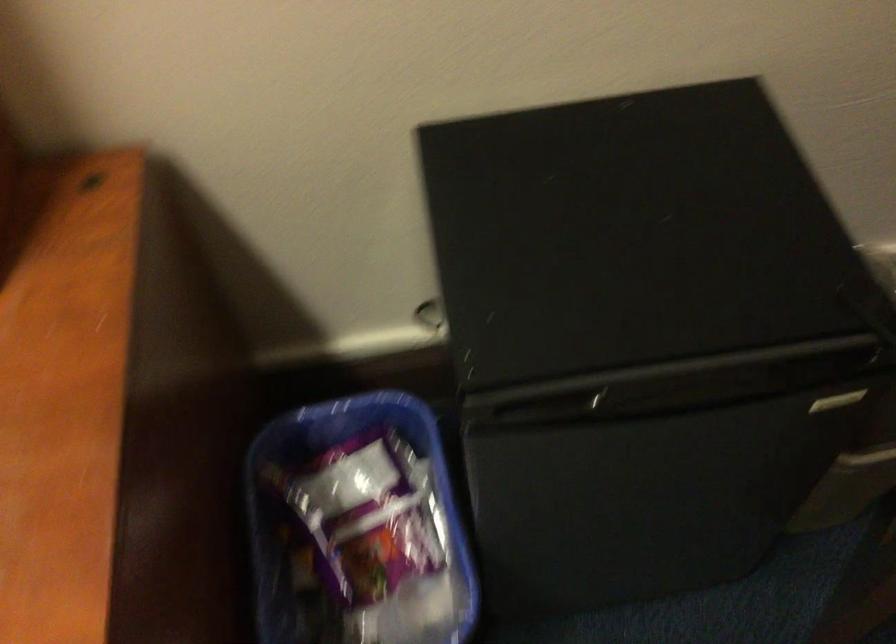
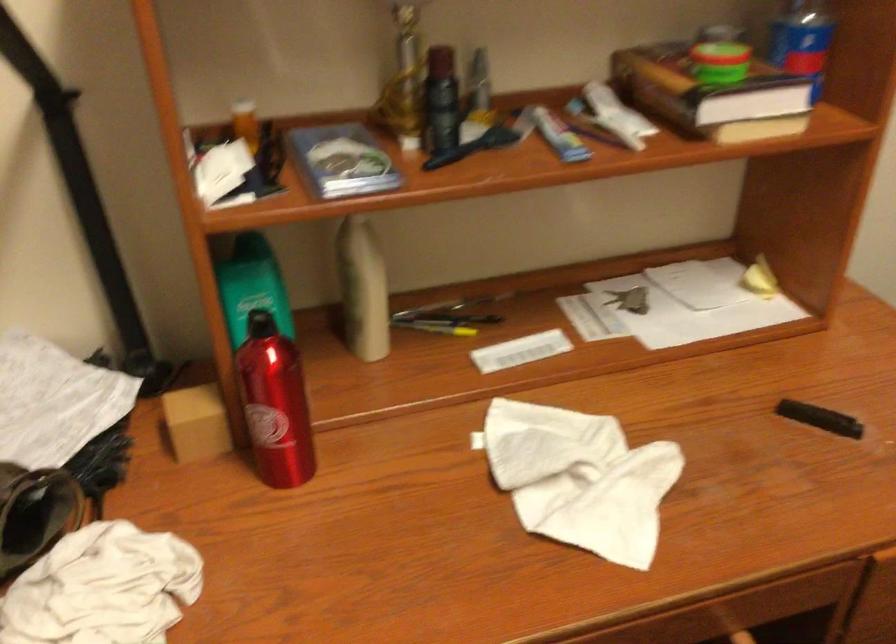
Question: In a continuous first-person perspective shot, in which direction is the camera moving?

Choices:
 (A) Left
 (B) Right
 (C) Forward
 (D) Backward

Answer: (A)